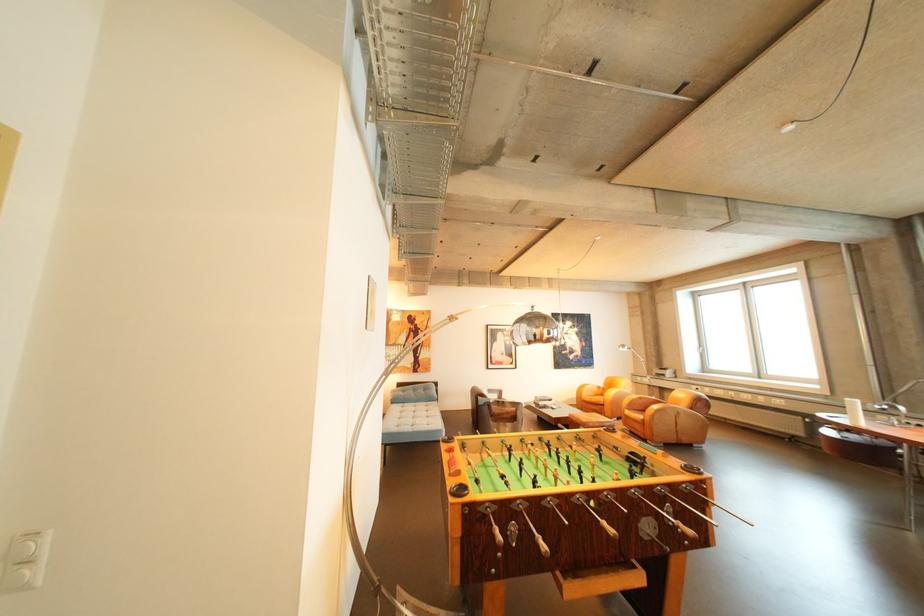
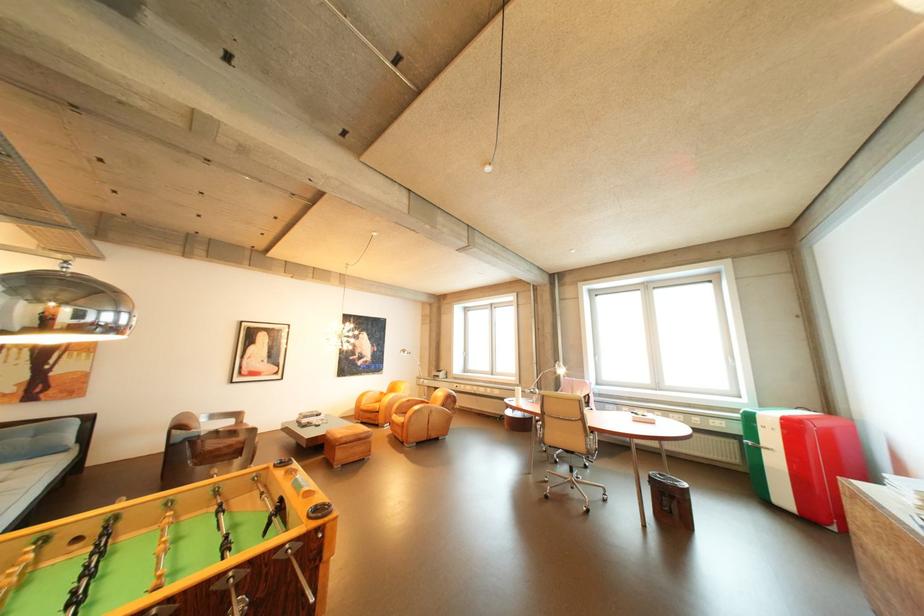
In the second image, find the point that corresponds to the point at 598,395 in the first image.

(377, 403)